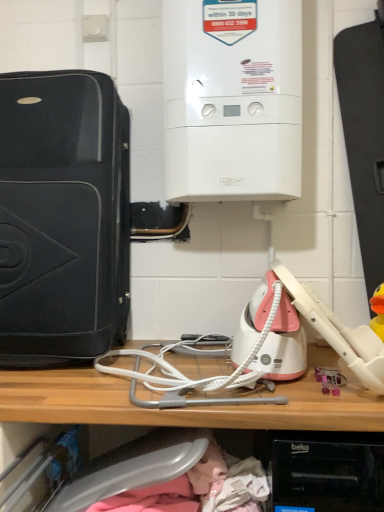
Locate an element on the screen. Image resolution: width=384 pixels, height=512 pixels. empty space that is ontop of white textured wire at center, the second wire positioned from the top is located at coordinates (188, 355).